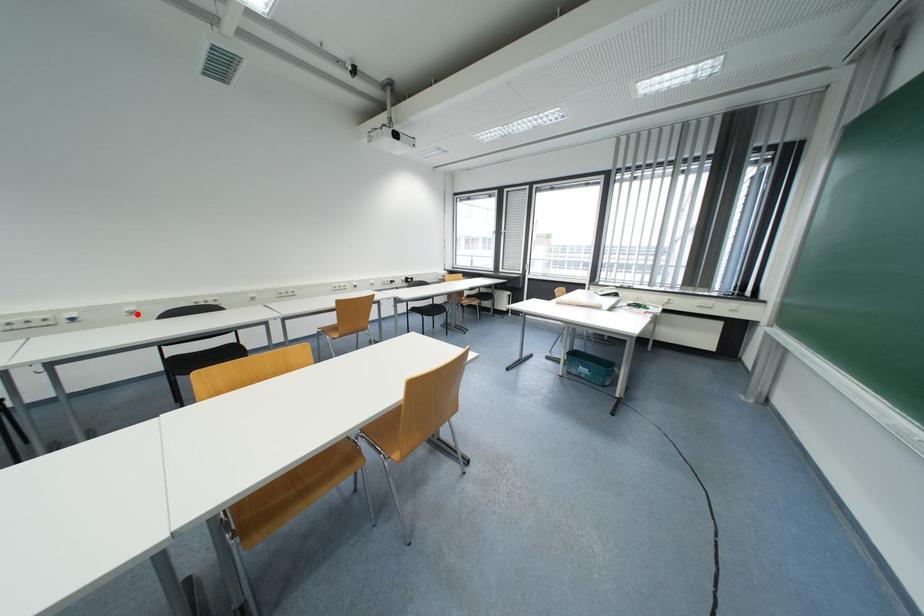
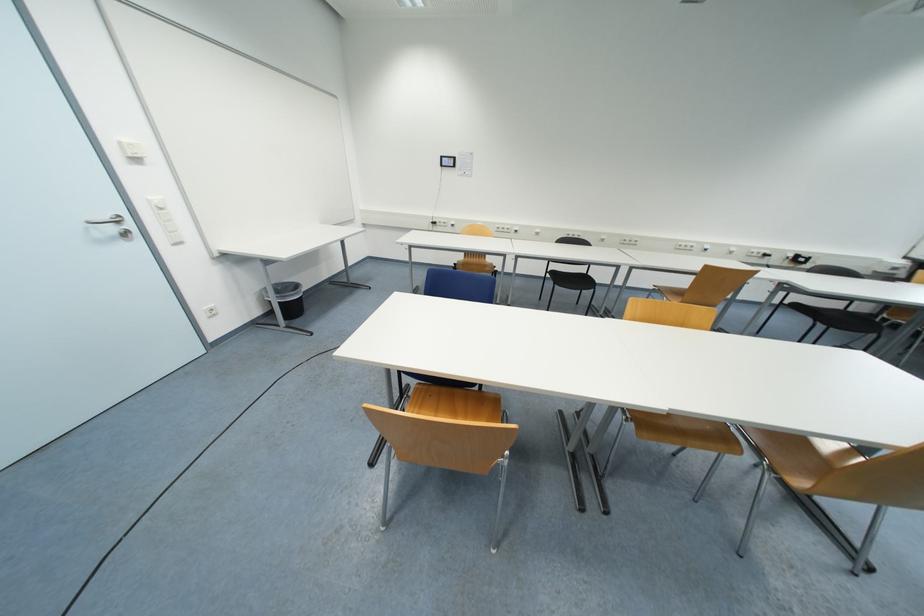
Question: A red point is marked in image1. In image2, is the corresponding 3D point closer to the camera or farther? Reply with the corresponding letter.

Choices:
 (A) The corresponding 3D point is closer.
 (B) The corresponding 3D point is farther.

Answer: (A)